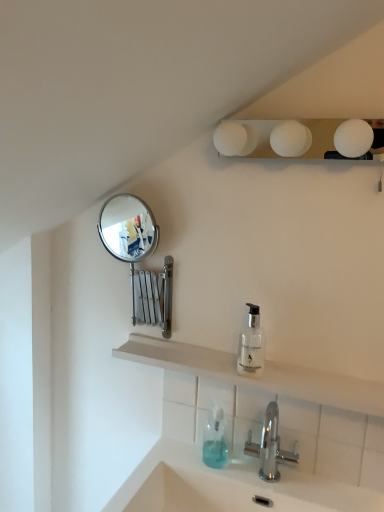
What do you see at coordinates (321, 138) in the screenshot? I see `white matte light fixture at upper center` at bounding box center [321, 138].

Describe the element at coordinates (251, 345) in the screenshot. I see `transparent glass soap dispenser at center, the first soap dispenser viewed from the right` at that location.

What do you see at coordinates (128, 232) in the screenshot? This screenshot has height=512, width=384. I see `silver metallic mirror at upper left` at bounding box center [128, 232].

What do you see at coordinates (257, 377) in the screenshot? This screenshot has width=384, height=512. I see `white matte shelf at center` at bounding box center [257, 377].

I want to click on white matte light fixture at upper center, so click(x=321, y=138).

Where is `tap above the white glossy sink at lower center (from the image's perspective)`? This screenshot has height=512, width=384. tap above the white glossy sink at lower center (from the image's perspective) is located at coordinates (270, 446).

Looking at this image, is white glossy sink at lower center turned away from chrome metallic faucet at lower center?

No, chrome metallic faucet at lower center is not at the back of white glossy sink at lower center.

Is white glossy sink at lower center taller than chrome metallic faucet at lower center?

Incorrect, the height of white glossy sink at lower center is not larger of that of chrome metallic faucet at lower center.

What's the angular difference between white glossy sink at lower center and chrome metallic faucet at lower center's facing directions?

The facing directions of white glossy sink at lower center and chrome metallic faucet at lower center are 0.00071 degrees apart.

From a real-world perspective, is white matte light fixture at upper center positioned above or below silver metallic mirror at upper left?

white matte light fixture at upper center is above silver metallic mirror at upper left.

From the image's perspective, who appears lower, white matte light fixture at upper center or silver metallic mirror at upper left?

silver metallic mirror at upper left.

Can you confirm if white matte light fixture at upper center is positioned to the right of silver metallic mirror at upper left?

Indeed, white matte light fixture at upper center is positioned on the right side of silver metallic mirror at upper left.

The image size is (384, 512). I want to click on tap on the right of silver metallic mirror at upper left, so click(x=270, y=446).

Who is more distant, chrome metallic faucet at lower center or silver metallic mirror at upper left?

silver metallic mirror at upper left is more distant.

Between chrome metallic faucet at lower center and silver metallic mirror at upper left, which one has larger size?

chrome metallic faucet at lower center.

Is transparent glass soap dispenser at center, the 2th soap dispenser in the bottom-to-top sequence, smaller than white glossy sink at lower center?

Indeed, transparent glass soap dispenser at center, the 2th soap dispenser in the bottom-to-top sequence, has a smaller size compared to white glossy sink at lower center.

Is transparent glass soap dispenser at center, the first soap dispenser viewed from the right, inside or outside of white glossy sink at lower center?

transparent glass soap dispenser at center, the first soap dispenser viewed from the right, is spatially situated outside white glossy sink at lower center.

From a real-world perspective, which soap dispenser is the 2nd one above the white glossy sink at lower center? Please provide its 2D coordinates.

[(251, 345)]

Which is in front, chrome metallic faucet at lower center or white matte shelf at center?

white matte shelf at center is more forward.

Does chrome metallic faucet at lower center appear on the right side of white matte shelf at center?

Indeed, chrome metallic faucet at lower center is positioned on the right side of white matte shelf at center.

Does point (249, 432) come farther from viewer compared to point (144, 357)?

That is False.

Does white matte shelf at center touch translucent plastic soap dispenser at lower center, which is the first soap dispenser in left-to-right order?

No, white matte shelf at center is not in contact with translucent plastic soap dispenser at lower center, which is the first soap dispenser in left-to-right order.

Considering the sizes of objects white matte shelf at center and translucent plastic soap dispenser at lower center, the 2th soap dispenser positioned from the top, in the image provided, who is smaller, white matte shelf at center or translucent plastic soap dispenser at lower center, the 2th soap dispenser positioned from the top,?

translucent plastic soap dispenser at lower center, the 2th soap dispenser positioned from the top.

You are a GUI agent. You are given a task and a screenshot of the screen. Output one action in this format:
    pyautogui.click(x=<x>, y=<y>)
    Task: Click on the shelve in front of the translucent plastic soap dispenser at lower center, placed as the first soap dispenser when sorted from bottom to top
    This screenshot has height=512, width=384.
    Given the screenshot: What is the action you would take?
    pyautogui.click(x=257, y=377)

Would you say white matte shelf at center is inside or outside translucent plastic soap dispenser at lower center, which is the first soap dispenser in left-to-right order?

white matte shelf at center is not inside translucent plastic soap dispenser at lower center, which is the first soap dispenser in left-to-right order, it's outside.

Find the location of `sink located below the white matte shelf at center (from the image's perspective)`. sink located below the white matte shelf at center (from the image's perspective) is located at coordinates (232, 482).

Is white matte shelf at center looking in the opposite direction of white glossy sink at lower center?

No, white matte shelf at center is not facing away from white glossy sink at lower center.

From a real-world perspective, is white matte shelf at center on top of white glossy sink at lower center?

Indeed, from a real-world perspective, white matte shelf at center stands above white glossy sink at lower center.

Which is behind, white matte shelf at center or white glossy sink at lower center?

Positioned behind is white matte shelf at center.

At what (x,y) coordinates should I click in order to perform the action: click on sink below the chrome metallic faucet at lower center (from the image's perspective). Please return your answer as a coordinate pair (x, y). Looking at the image, I should click on (232, 482).

In order to click on mirror lying on the left of white matte light fixture at upper center in this screenshot , I will do `click(128, 232)`.

When comparing their distances from white matte light fixture at upper center, does white matte shelf at center or transparent glass soap dispenser at center, the first soap dispenser viewed from the right, seem further?

white matte shelf at center.

When comparing their distances from transparent glass soap dispenser at center, the 2th soap dispenser from the left, does chrome metallic faucet at lower center or white matte shelf at center seem further?

chrome metallic faucet at lower center is further to transparent glass soap dispenser at center, the 2th soap dispenser from the left.

When comparing their distances from silver metallic mirror at upper left, does chrome metallic faucet at lower center or transparent glass soap dispenser at center, the first soap dispenser viewed from the right, seem further?

chrome metallic faucet at lower center is positioned further to the anchor silver metallic mirror at upper left.

When comparing their distances from white glossy sink at lower center, does white matte shelf at center or silver metallic mirror at upper left seem closer?

Based on the image, white matte shelf at center appears to be nearer to white glossy sink at lower center.

From the image, which object appears to be nearer to chrome metallic faucet at lower center, translucent plastic soap dispenser at lower center, which is the first soap dispenser in left-to-right order, or white glossy sink at lower center?

translucent plastic soap dispenser at lower center, which is the first soap dispenser in left-to-right order.

Considering their positions, is white glossy sink at lower center positioned further to transparent glass soap dispenser at center, the 2th soap dispenser from the left, than chrome metallic faucet at lower center?

Based on the image, white glossy sink at lower center appears to be further to transparent glass soap dispenser at center, the 2th soap dispenser from the left.

In the scene shown: Considering their positions, is white matte light fixture at upper center positioned closer to white matte shelf at center than transparent glass soap dispenser at center, positioned as the first soap dispenser in top-to-bottom order?

transparent glass soap dispenser at center, positioned as the first soap dispenser in top-to-bottom order, is closer to white matte shelf at center.

From the image, which object appears to be nearer to transparent glass soap dispenser at center, the first soap dispenser viewed from the right, white matte shelf at center or chrome metallic faucet at lower center?

white matte shelf at center is closer to transparent glass soap dispenser at center, the first soap dispenser viewed from the right.

Locate an element on the screen. tap between transparent glass soap dispenser at center, the first soap dispenser viewed from the right, and translucent plastic soap dispenser at lower center, which is the 2th soap dispenser in right-to-left order, vertically is located at coordinates point(270,446).

I want to click on shelve between silver metallic mirror at upper left and chrome metallic faucet at lower center in the up-down direction, so click(x=257, y=377).

Find the location of a particular element. The width and height of the screenshot is (384, 512). soap dispenser between silver metallic mirror at upper left and chrome metallic faucet at lower center vertically is located at coordinates (251, 345).

Where is `shelve between white matte light fixture at upper center and translucent plastic soap dispenser at lower center, which is the 2th soap dispenser in right-to-left order, in the vertical direction`? The height and width of the screenshot is (512, 384). shelve between white matte light fixture at upper center and translucent plastic soap dispenser at lower center, which is the 2th soap dispenser in right-to-left order, in the vertical direction is located at coordinates (257, 377).